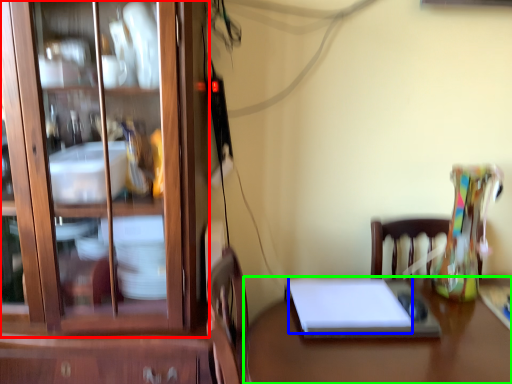
Question: Which object is the closest to the cabinetry (highlighted by a red box)? Choose among these: notebook (highlighted by a blue box) or desk (highlighted by a green box).

Choices:
 (A) notebook
 (B) desk

Answer: (A)